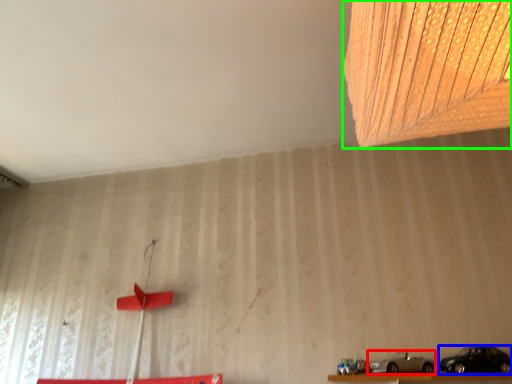
Question: Based on their relative distances, which object is nearer to car (highlighted by a red box)? Choose from car (highlighted by a blue box) and lamp (highlighted by a green box).

Choices:
 (A) car
 (B) lamp

Answer: (A)